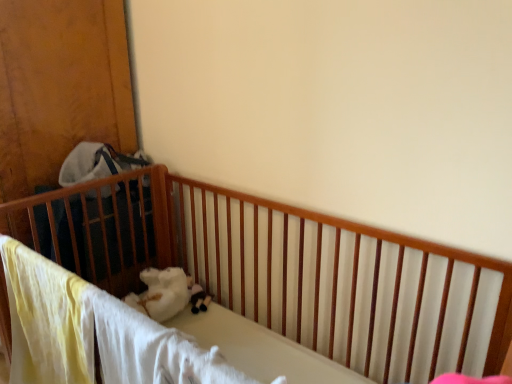
Question: Is point (73, 220) positioned closer to the camera than point (190, 294)?

Choices:
 (A) farther
 (B) closer

Answer: (B)

Question: Considering the positions of wooden crib at left and soft plush toy at center in the image, is wooden crib at left wider or thinner than soft plush toy at center?

Choices:
 (A) wide
 (B) thin

Answer: (A)

Question: Relative to soft plush toy at center, is wooden crib at left in front or behind?

Choices:
 (A) front
 (B) behind

Answer: (A)

Question: Is soft plush toy at center taller or shorter than wooden crib at left?

Choices:
 (A) tall
 (B) short

Answer: (B)

Question: From the image's perspective, is soft plush toy at center located above or below wooden crib at left?

Choices:
 (A) below
 (B) above

Answer: (A)

Question: Does point (192, 292) appear closer or farther from the camera than point (134, 258)?

Choices:
 (A) farther
 (B) closer

Answer: (B)

Question: Based on their sizes in the image, would you say soft plush toy at center is bigger or smaller than wooden crib at left?

Choices:
 (A) big
 (B) small

Answer: (B)